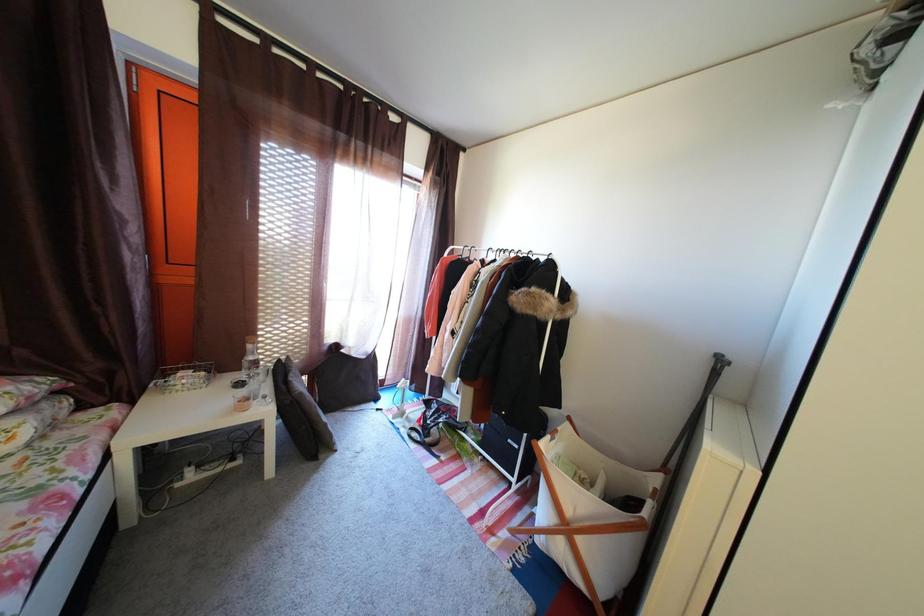
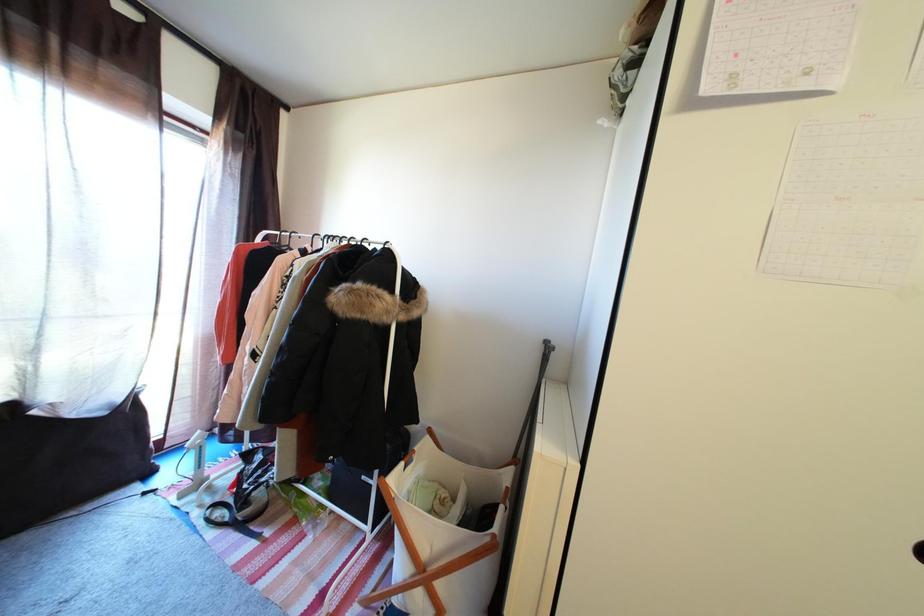
Question: The first image is from the beginning of the video and the second image is from the end. How did the camera likely rotate when shooting the video?

Choices:
 (A) Left
 (B) Right
 (C) Up
 (D) Down

Answer: (B)